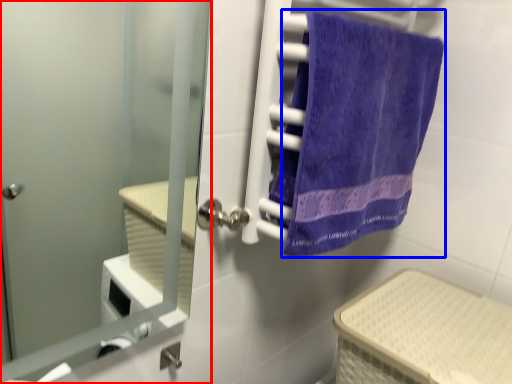
Question: Which point is further to the camera, door (highlighted by a red box) or towel (highlighted by a blue box)?

Choices:
 (A) door
 (B) towel

Answer: (B)